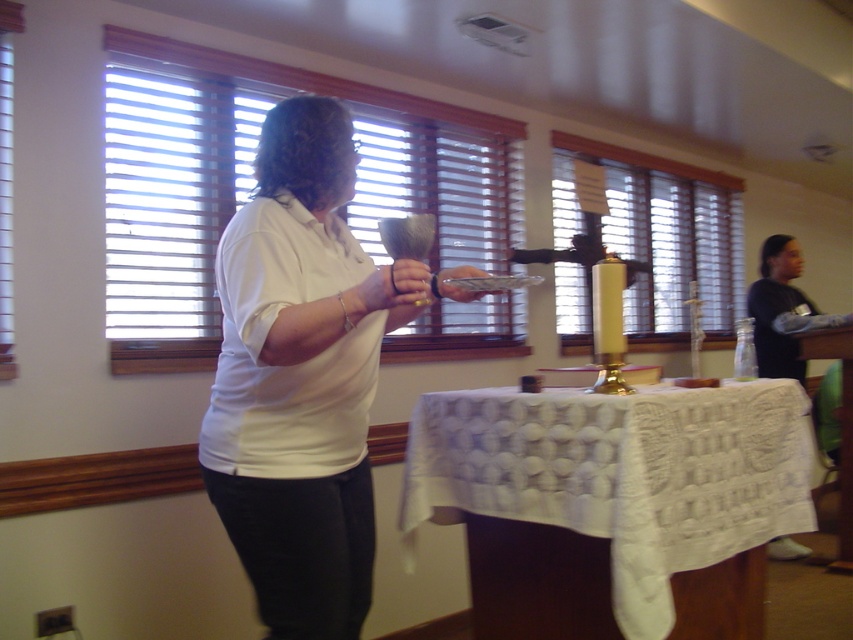
Question: Among these objects, which one is nearest to the camera?

Choices:
 (A) white matte shirt at center
 (B) white lace tablecloth at center

Answer: (A)

Question: Which of the following is the closest to the observer?

Choices:
 (A) white matte shirt at center
 (B) white lace tablecloth at center

Answer: (A)

Question: Among these objects, which one is nearest to the camera?

Choices:
 (A) white lace tablecloth at center
 (B) white matte shirt at center

Answer: (B)

Question: Can you confirm if white matte shirt at center is positioned to the left of white lace tablecloth at center?

Choices:
 (A) yes
 (B) no

Answer: (A)

Question: Where is white matte shirt at center located in relation to white lace tablecloth at center in the image?

Choices:
 (A) below
 (B) above

Answer: (B)

Question: Is white matte shirt at center positioned at the back of white lace tablecloth at center?

Choices:
 (A) yes
 (B) no

Answer: (B)